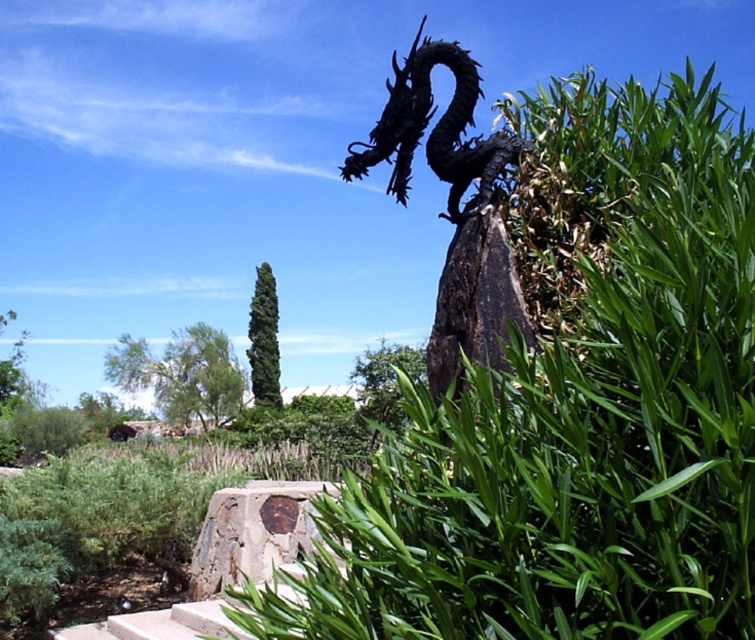
You are a gardener who needs to place a new statue that is 1.2 meters tall. You have two options for placement spots in the image. The first spot is near the rusty concrete block at center, and the second is near the green leafy bush at center. Which spot would allow the statue to be more visible from above?

The statue would be more visible from above when placed near the rusty concrete block at center because the rusty concrete block at center is not as tall as the green leafy bush at center, so the area around it is lower, making the statue more visible.